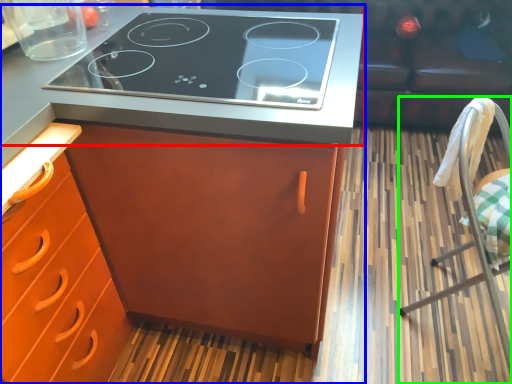
Question: Considering the real-world distances, which object is closest to countertop (highlighted by a red box)? cabinetry (highlighted by a blue box) or chair (highlighted by a green box).

Choices:
 (A) cabinetry
 (B) chair

Answer: (A)